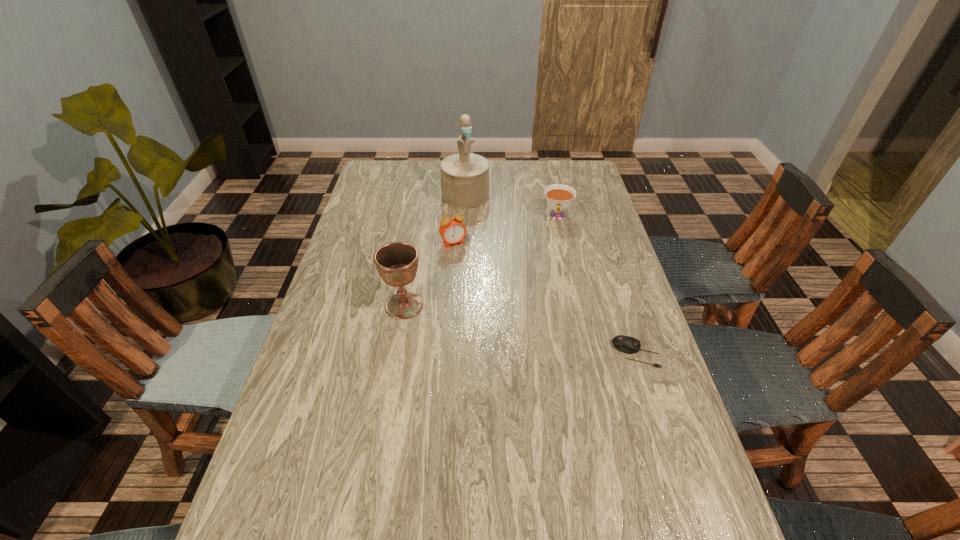
You are a GUI agent. You are given a task and a screenshot of the screen. Output one action in this format:
    pyautogui.click(x=<x>, y=<y>)
    Task: Click on the vacant space on the desktop that is between the second nearest object and the mouse and is positioned on the side of the teacup with the handle
    This screenshot has height=540, width=960.
    Given the screenshot: What is the action you would take?
    pyautogui.click(x=545, y=335)

In order to click on free space on the desktop that is between the fourth shortest object and the mouse and is positioned at the beak of the figurine in this screenshot , I will do `click(520, 329)`.

Where is `free space on the desktop that is between the chalice and the shortest object and is positioned on the face of the third nearest object`? free space on the desktop that is between the chalice and the shortest object and is positioned on the face of the third nearest object is located at coordinates (508, 327).